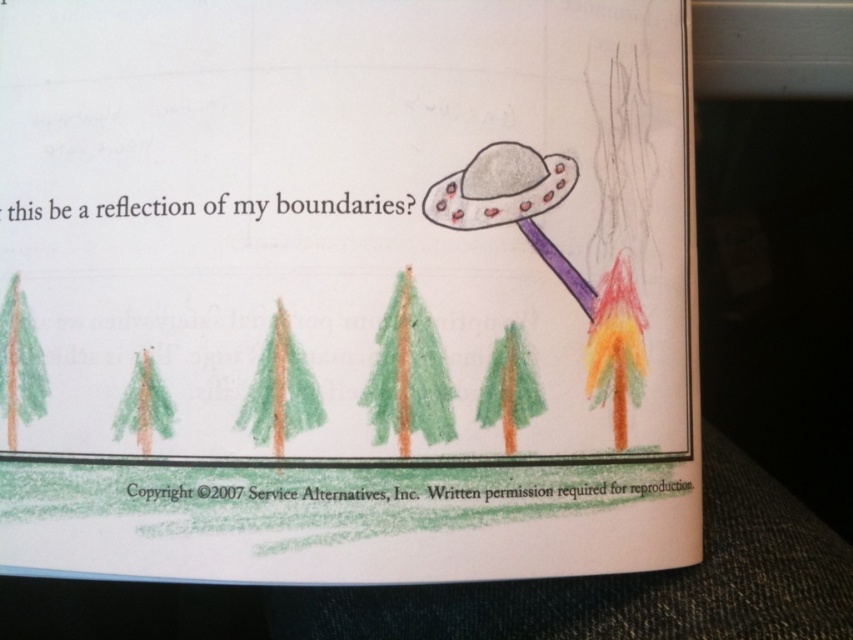
What object is located at the coordinates point (x=408, y=372)?

The green textured tree at center is located at point (x=408, y=372).

You are an art teacher reviewing a student drawing. You notice the green textured tree at center and the black paper at upper center. Which object is located to the left of the other?

The black paper at upper center is located to the left of the green textured tree at center.

You are an art teacher reviewing a student drawing. The drawing has a black paper at lower center and a multicolored crayon tree at right. Which object in the drawing is wider?

The black paper at lower center is wider than the multicolored crayon tree at right.